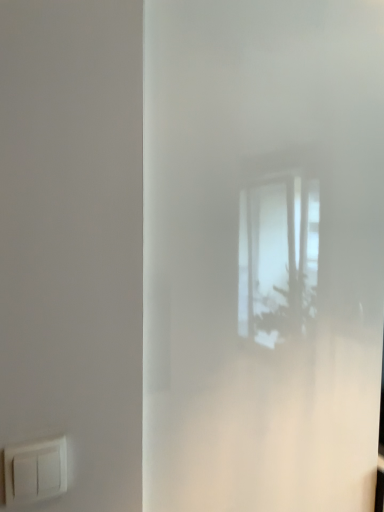
This screenshot has width=384, height=512. Find the location of `white plastic light switch at lower left`. white plastic light switch at lower left is located at coordinates (35, 471).

Measure the distance between point (8, 472) and camera.

The distance of point (8, 472) from camera is 23.62 inches.

This screenshot has width=384, height=512. What do you see at coordinates (35, 471) in the screenshot? I see `white plastic light switch at lower left` at bounding box center [35, 471].

I want to click on white plastic light switch at lower left, so click(x=35, y=471).